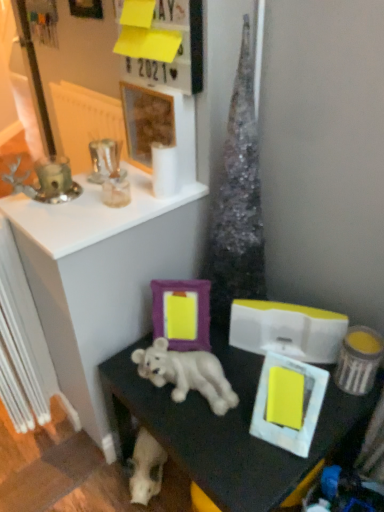
Locate an element on the screen. This screenshot has width=384, height=512. space that is in front of white matte dog at center is located at coordinates (236, 460).